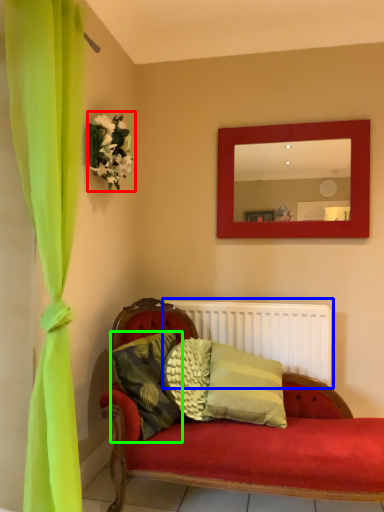
Question: Which object is the farthest from floral arrangement (highlighted by a red box)? Choose among these: radiator (highlighted by a blue box) or pillow (highlighted by a green box).

Choices:
 (A) radiator
 (B) pillow

Answer: (A)